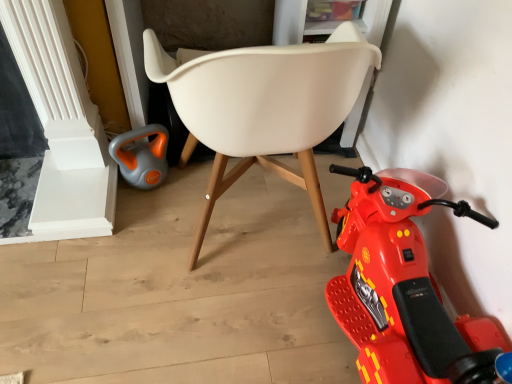
Question: Is shiny plastic scooter at lower right in front of or behind gray-orange plastic kettle at lower left in the image?

Choices:
 (A) front
 (B) behind

Answer: (A)

Question: From the image's perspective, is shiny plastic scooter at lower right positioned above or below gray-orange plastic kettle at lower left?

Choices:
 (A) below
 (B) above

Answer: (A)

Question: Which of these objects is positioned closest to the shiny plastic scooter at lower right?

Choices:
 (A) white plastic chair at center
 (B) gray-orange plastic kettle at lower left

Answer: (A)

Question: Considering the real-world distances, which object is closest to the shiny plastic scooter at lower right?

Choices:
 (A) gray-orange plastic kettle at lower left
 (B) white plastic chair at center

Answer: (B)